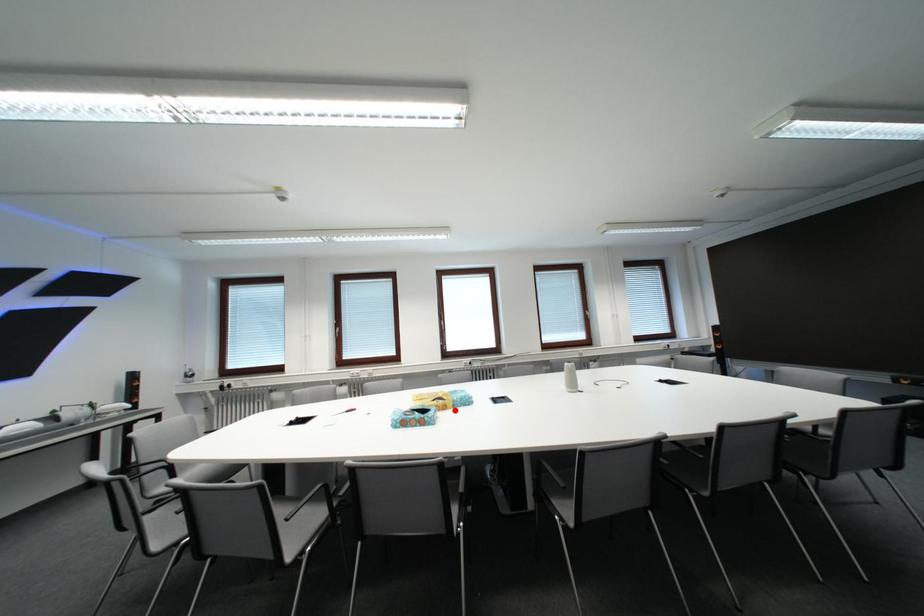
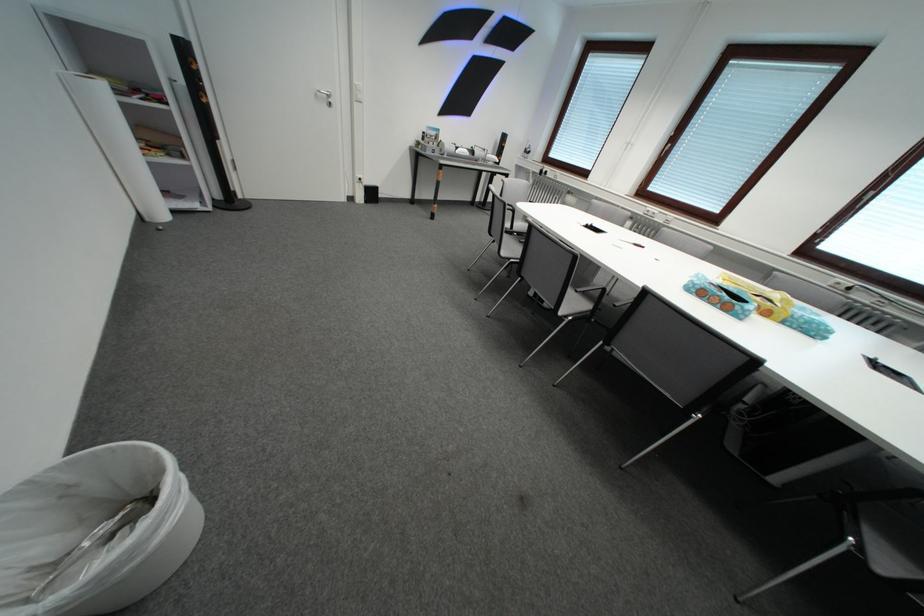
Where in the second image is the point corresponding to the highlighted location from the first image?

(776, 315)